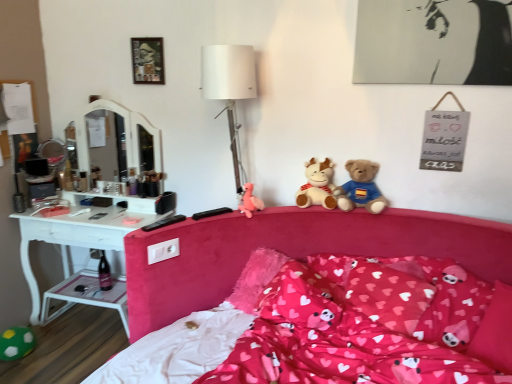
Question: Considering the relative sizes of pink plush pillow at center, arranged as the second pillow when viewed from the left, and velvet pink bed at center in the image provided, is pink plush pillow at center, arranged as the second pillow when viewed from the left, smaller than velvet pink bed at center?

Choices:
 (A) no
 (B) yes

Answer: (B)

Question: Are pink plush pillow at center, arranged as the second pillow when viewed from the left, and velvet pink bed at center beside each other?

Choices:
 (A) yes
 (B) no

Answer: (B)

Question: Can you confirm if pink plush pillow at center, arranged as the second pillow when viewed from the left, is thinner than velvet pink bed at center?

Choices:
 (A) no
 (B) yes

Answer: (B)

Question: Does pink plush pillow at center, the 2th pillow in the right-to-left sequence, lie behind velvet pink bed at center?

Choices:
 (A) no
 (B) yes

Answer: (B)

Question: Considering the relative sizes of pink plush pillow at center, the 2th pillow in the right-to-left sequence, and velvet pink bed at center in the image provided, is pink plush pillow at center, the 2th pillow in the right-to-left sequence, shorter than velvet pink bed at center?

Choices:
 (A) yes
 (B) no

Answer: (A)

Question: Is pink plush pillow at center, the 2th pillow in the right-to-left sequence, in front of or behind fluffy pink pillow at center, which appears as the first pillow when viewed from the left, in the image?

Choices:
 (A) front
 (B) behind

Answer: (A)

Question: From the image's perspective, is pink plush pillow at center, the 2th pillow in the right-to-left sequence, above or below fluffy pink pillow at center, the third pillow from the right?

Choices:
 (A) below
 (B) above

Answer: (A)

Question: Is point click(463, 274) positioned closer to the camera than point click(296, 322)?

Choices:
 (A) closer
 (B) farther

Answer: (B)

Question: Is pink plush pillow at center, the 2th pillow in the right-to-left sequence, wider or thinner than fluffy pink pillow at center, which appears as the first pillow when viewed from the left?

Choices:
 (A) thin
 (B) wide

Answer: (B)

Question: Considering the positions of point (329, 165) and point (12, 357), is point (329, 165) closer or farther from the camera than point (12, 357)?

Choices:
 (A) farther
 (B) closer

Answer: (B)

Question: From their relative heights in the image, would you say white plush reindeer at center, which ranks as the 3th toy in left-to-right order, is taller or shorter than green fuzzy ball at lower left, positioned as the 3th toy in right-to-left order?

Choices:
 (A) tall
 (B) short

Answer: (A)

Question: Do you think white plush reindeer at center, which is the third toy from bottom to top, is within green fuzzy ball at lower left, positioned as the 3th toy in right-to-left order, or outside of it?

Choices:
 (A) inside
 (B) outside

Answer: (B)

Question: From a real-world perspective, is white plush reindeer at center, which is the third toy from bottom to top, above or below green fuzzy ball at lower left, positioned as the 3th toy in right-to-left order?

Choices:
 (A) below
 (B) above

Answer: (B)

Question: Is green fuzzy ball at lower left, positioned as the 3th toy in right-to-left order, wider or thinner than soft plush teddy bear at center?

Choices:
 (A) thin
 (B) wide

Answer: (B)

Question: Is point (8, 352) positioned closer to the camera than point (373, 203)?

Choices:
 (A) closer
 (B) farther

Answer: (B)